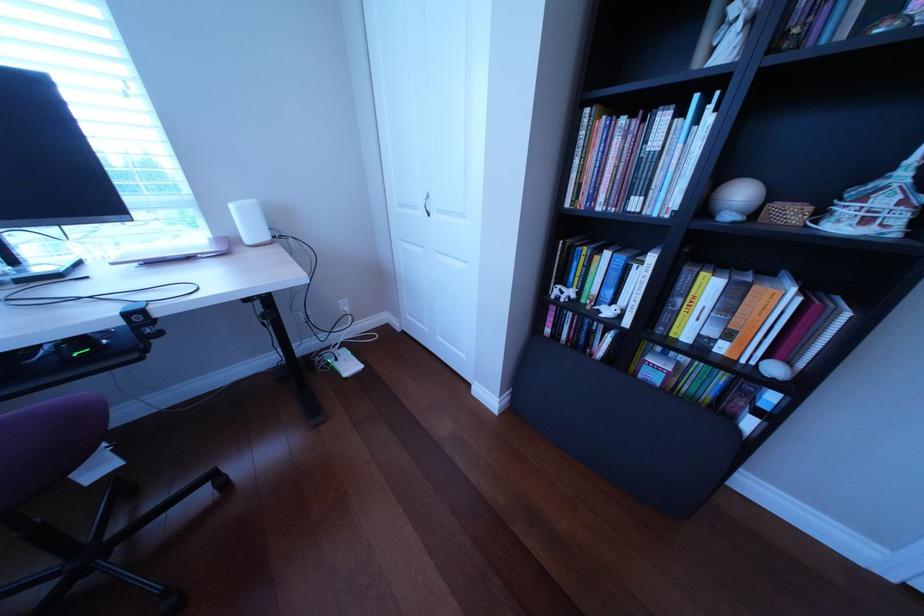
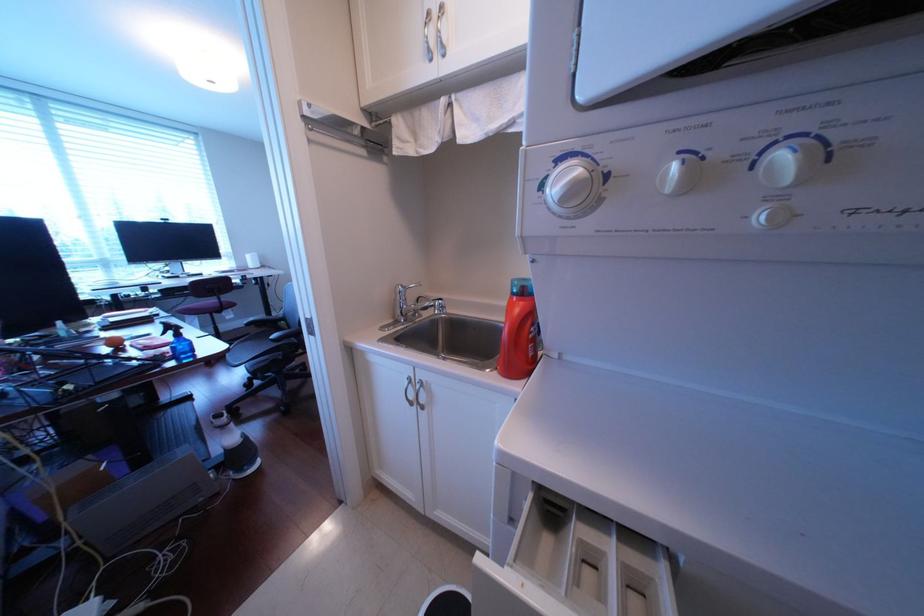
Question: Which direction would the cameraman need to move to produce the second image? Reply with the corresponding letter.

Choices:
 (A) Left
 (B) Right
 (C) Forward
 (D) Backward

Answer: (D)